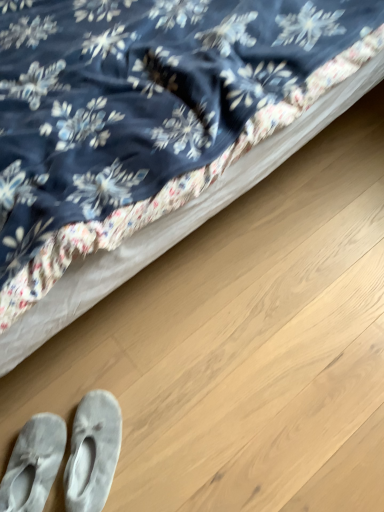
You are a GUI agent. You are given a task and a screenshot of the screen. Output one action in this format:
    pyautogui.click(x=<x>, y=<y>)
    Task: Click on the free spot below light gray suede slippers at lower left, arranged as the second footwear when viewed from the left (from a real-world perspective)
    The height and width of the screenshot is (512, 384).
    Given the screenshot: What is the action you would take?
    pos(94,463)